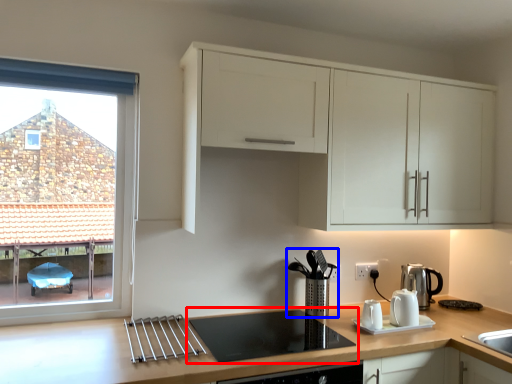
Question: Which object is closer to the camera taking this photo, gas stove (highlighted by a red box) or coffee machine (highlighted by a blue box)?

Choices:
 (A) gas stove
 (B) coffee machine

Answer: (A)